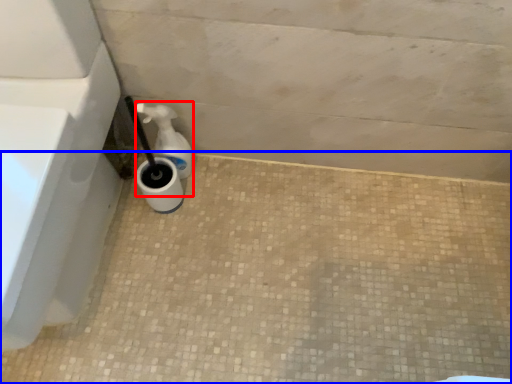
Question: Which object appears closest to the camera in this image, soap dispenser (highlighted by a red box) or concrete (highlighted by a blue box)?

Choices:
 (A) soap dispenser
 (B) concrete

Answer: (B)